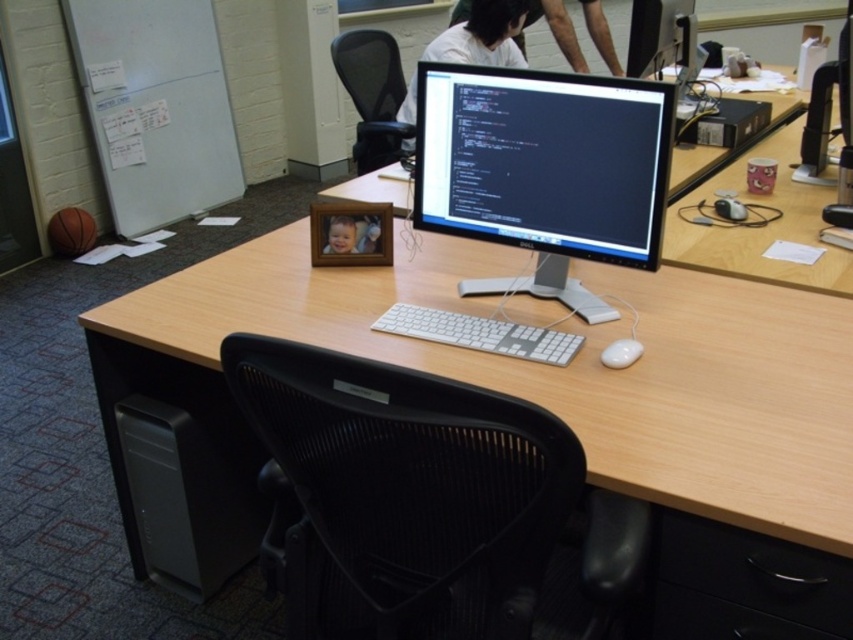
You are organizing your desk and want to place a new 12 inch wide decorative item between the black plastic drawer at lower right and the white glossy mouse at lower right. Is there enough space for it?

The black plastic drawer at lower right is 17.72 inches away from the white glossy mouse at lower right. Since the decorative item is 12 inches wide, there is enough space between them to place it.

You are setting up a new desk arrangement and want to place a plant between the white plastic keyboard at center and the satin black monitor at upper center. Since the monitor is taller, where should you position the plant so it doesn

The white plastic keyboard at center has a lesser height compared to the satin black monitor at upper center, so positioning the plant between them would require placing it closer to the keyboard to avoid blocking the view of the monitor.

You are setting up a new computer desk and want to place both the white plastic keyboard at center and the satin black monitor at upper center. Based on the scene description, where should you place the keyboard relative to the monitor?

The white plastic keyboard at center should be placed under the satin black monitor at upper center as per the scene description.